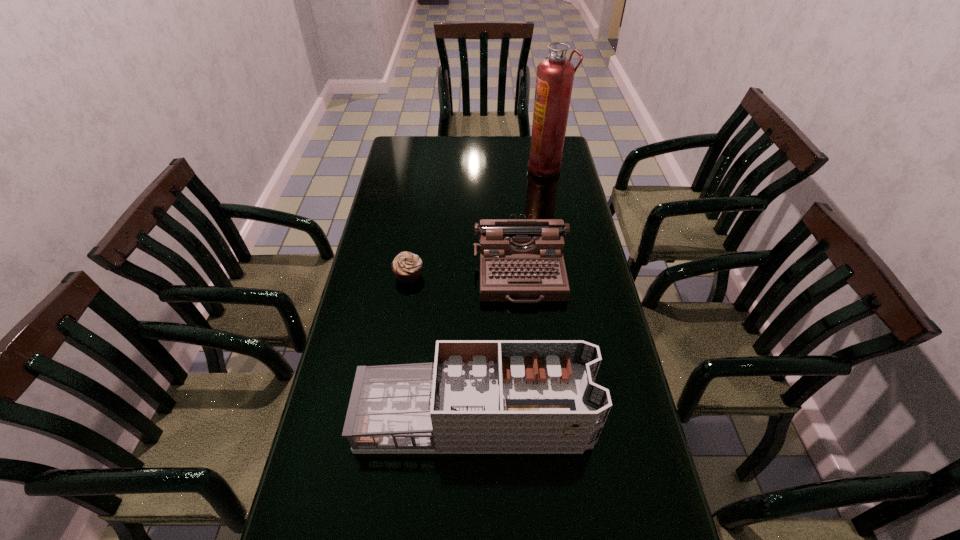
Where is `vacant region that satisfies the following two spatial constraints: 1. on the side of the farthest object with the label; 2. on the front side of the shortest object`? vacant region that satisfies the following two spatial constraints: 1. on the side of the farthest object with the label; 2. on the front side of the shortest object is located at coordinates (566, 275).